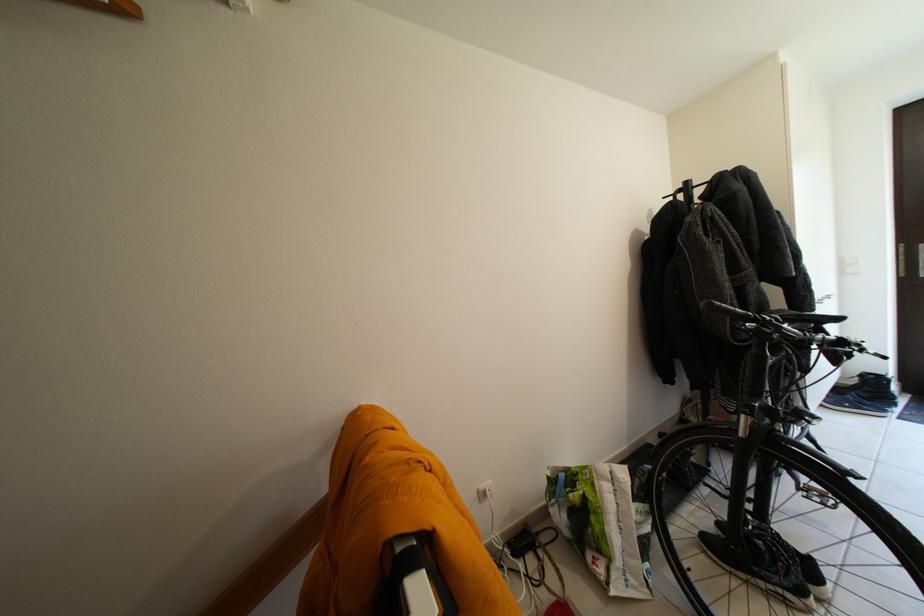
The image size is (924, 616). What are the coordinates of `black power adapter` in the screenshot? It's located at (520, 543).